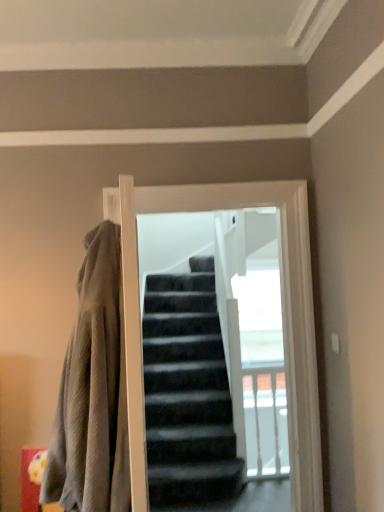
Question: From the image's perspective, is textured gray blanket at left positioned above or below black matte screen door at center?

Choices:
 (A) above
 (B) below

Answer: (B)

Question: Considering the positions of point (94, 292) and point (241, 202), is point (94, 292) closer or farther from the camera than point (241, 202)?

Choices:
 (A) closer
 (B) farther

Answer: (A)

Question: Is textured gray blanket at left bigger or smaller than black matte screen door at center?

Choices:
 (A) big
 (B) small

Answer: (A)

Question: Is black matte screen door at center bigger or smaller than textured gray blanket at left?

Choices:
 (A) small
 (B) big

Answer: (A)

Question: Does point (125, 242) appear closer or farther from the camera than point (61, 461)?

Choices:
 (A) closer
 (B) farther

Answer: (A)

Question: Choose the correct answer: Is black matte screen door at center inside textured gray blanket at left or outside it?

Choices:
 (A) inside
 (B) outside

Answer: (B)

Question: From the image's perspective, is black matte screen door at center positioned above or below textured gray blanket at left?

Choices:
 (A) below
 (B) above

Answer: (B)